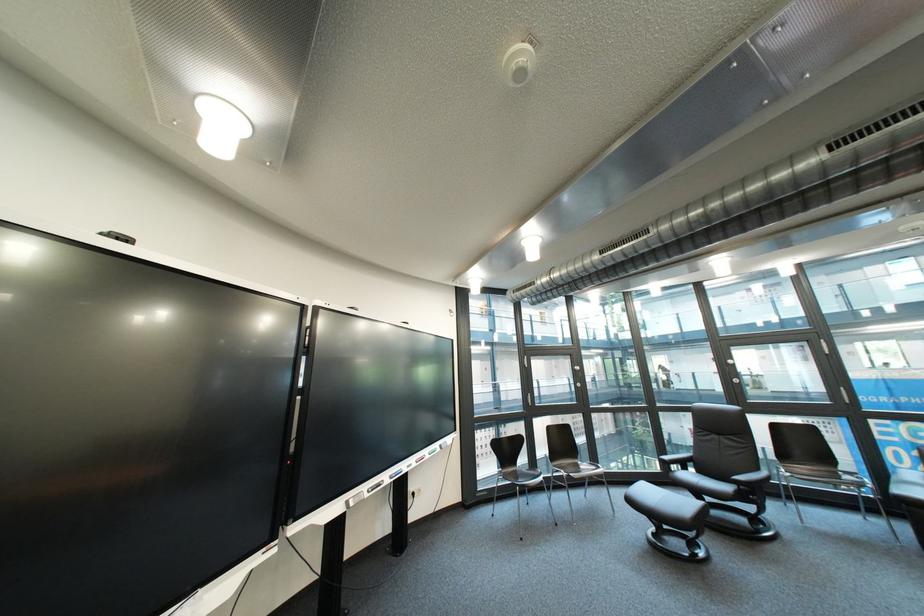
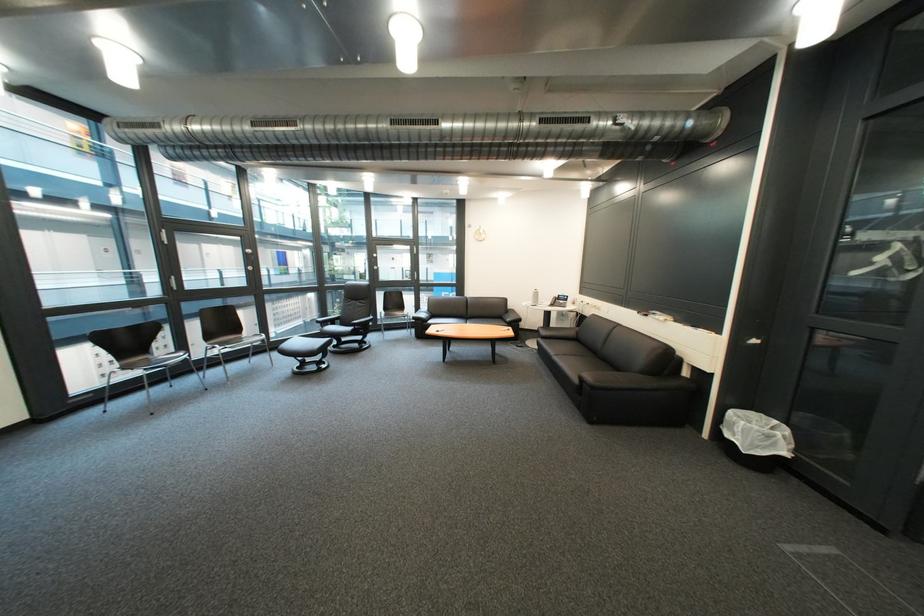
Where in the second image is the point corresponding to pixel 662 495 from the first image?

(311, 345)